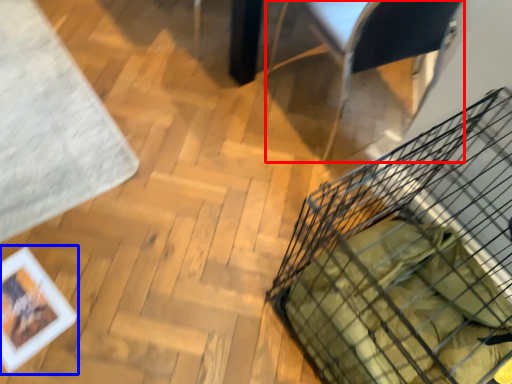
Question: Which point is further to the camera, armchair (highlighted by a red box) or picture frame (highlighted by a blue box)?

Choices:
 (A) armchair
 (B) picture frame

Answer: (B)